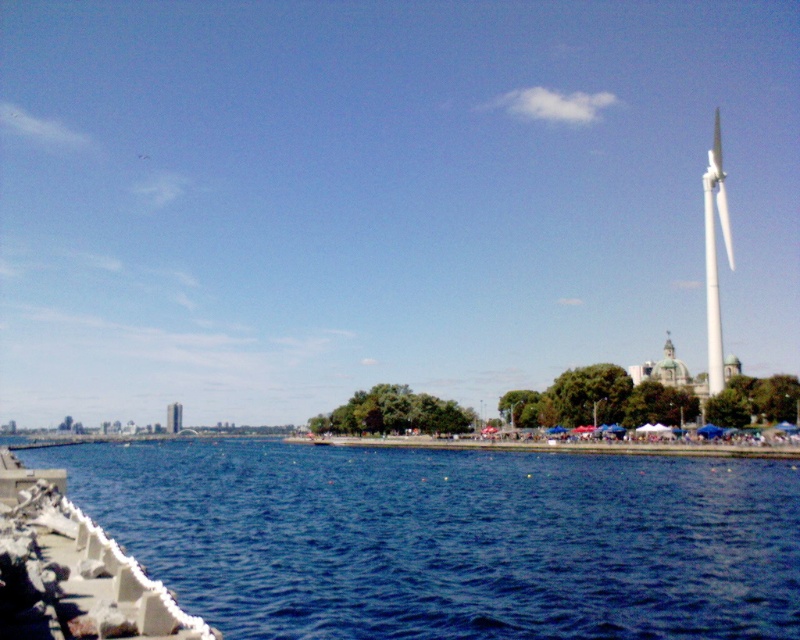
Between point (536, 593) and point (717, 365), which one is positioned in front?

Positioned in front is point (536, 593).

Can you confirm if blue water at lower left is thinner than white smooth wind turbine at right?

Incorrect, blue water at lower left's width is not less than white smooth wind turbine at right's.

Identify the location of blue water at lower left. (450, 538).

The height and width of the screenshot is (640, 800). I want to click on blue water at lower left, so click(x=450, y=538).